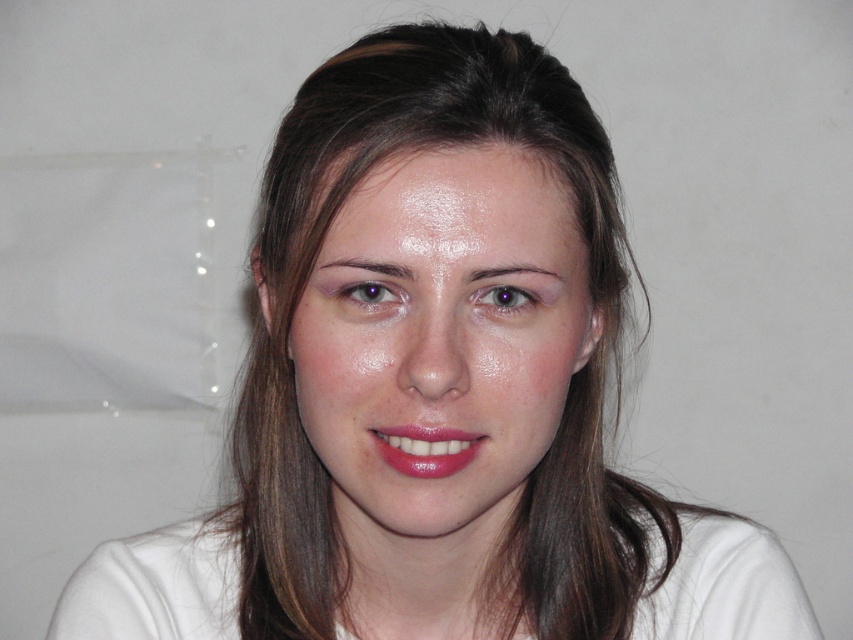
Question: Which point is farther from the camera taking this photo?

Choices:
 (A) (471, 422)
 (B) (392, 291)

Answer: (A)

Question: Which of the following is the closest to the observer?

Choices:
 (A) glossy matte lipstick at center
 (B) purple glossy eye at center
 (C) matte skin eye at center
 (D) smooth skin face at center

Answer: (D)

Question: Is glossy matte lipstick at center further to the viewer compared to matte skin eye at center?

Choices:
 (A) yes
 (B) no

Answer: (A)

Question: Can you confirm if smooth skin face at center is positioned to the right of matte skin eye at center?

Choices:
 (A) yes
 (B) no

Answer: (A)

Question: Is smooth skin face at center thinner than matte skin eye at center?

Choices:
 (A) yes
 (B) no

Answer: (B)

Question: Which is nearer to the smooth skin face at center?

Choices:
 (A) purple glossy eye at center
 (B) glossy matte lipstick at center

Answer: (B)